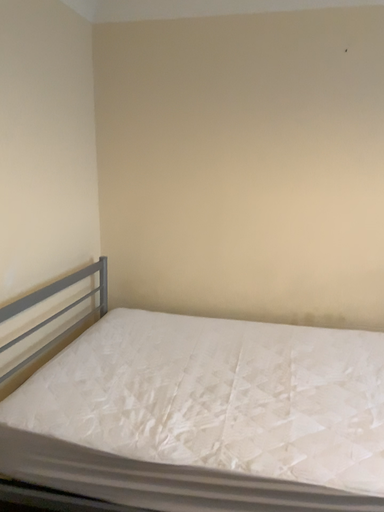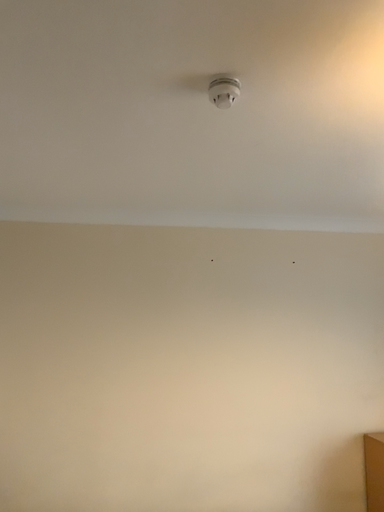
Question: Which way did the camera rotate in the video?

Choices:
 (A) rotated right
 (B) rotated left

Answer: (A)